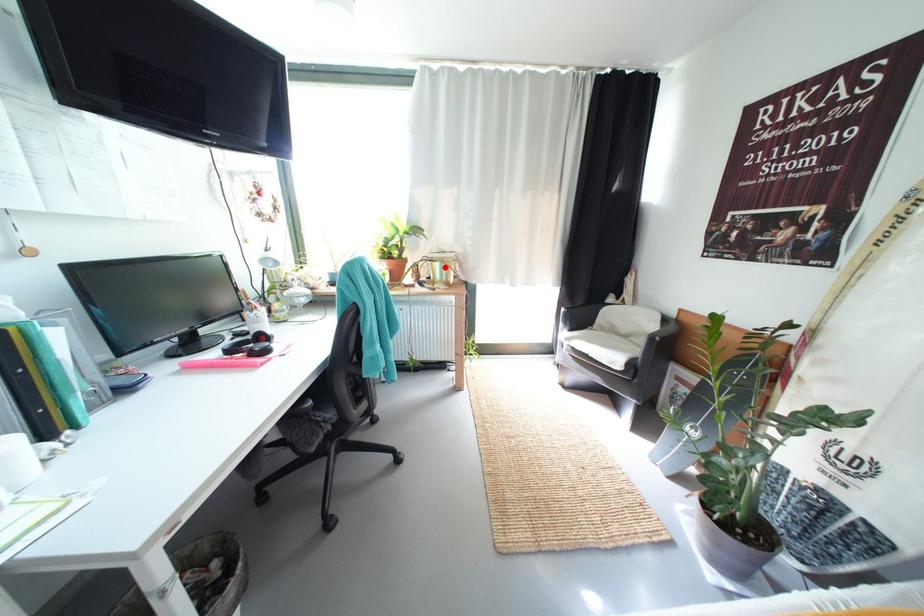
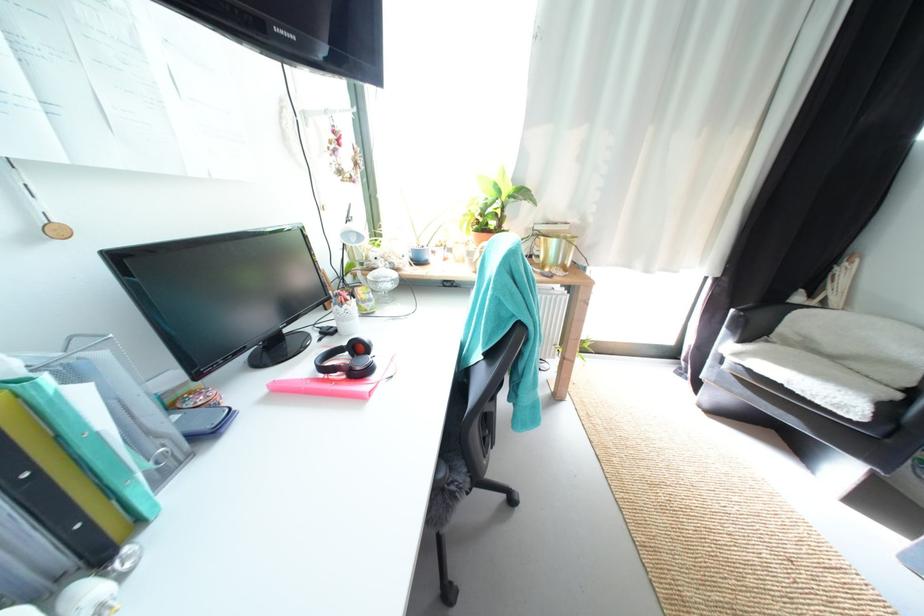
Where in the second image is the point corresponding to the highlighted location from the first image?

(562, 244)